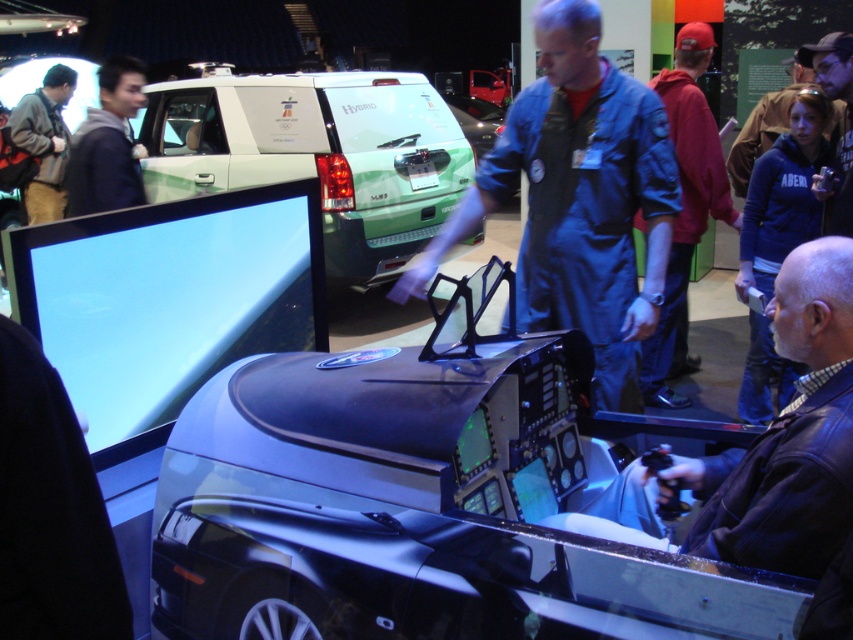
You are a visitor at the exhibition and want to take a photo of both the blue denim jumpsuit at center and the blue fleece jacket at upper right. Which one should you focus on first to ensure both are in sharp focus?

You should focus on the blue denim jumpsuit at center first because it is closer to you than the blue fleece jacket at upper right. By focusing on the closer object, the background object may still be in focus depending on the camera settings, but focusing on the closer one ensures both are sharp if the depth of field is sufficient.